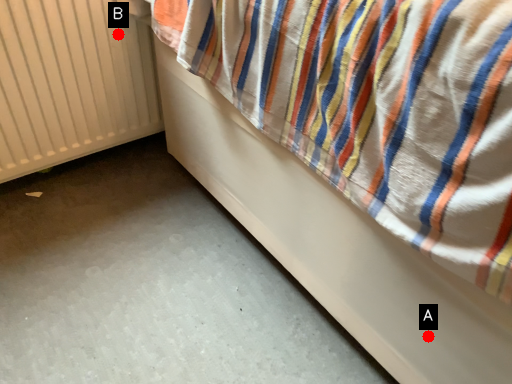
Question: Two points are circled on the image, labeled by A and B beside each circle. Which point appears closest to the camera in this image?

Choices:
 (A) A is closer
 (B) B is closer

Answer: (A)